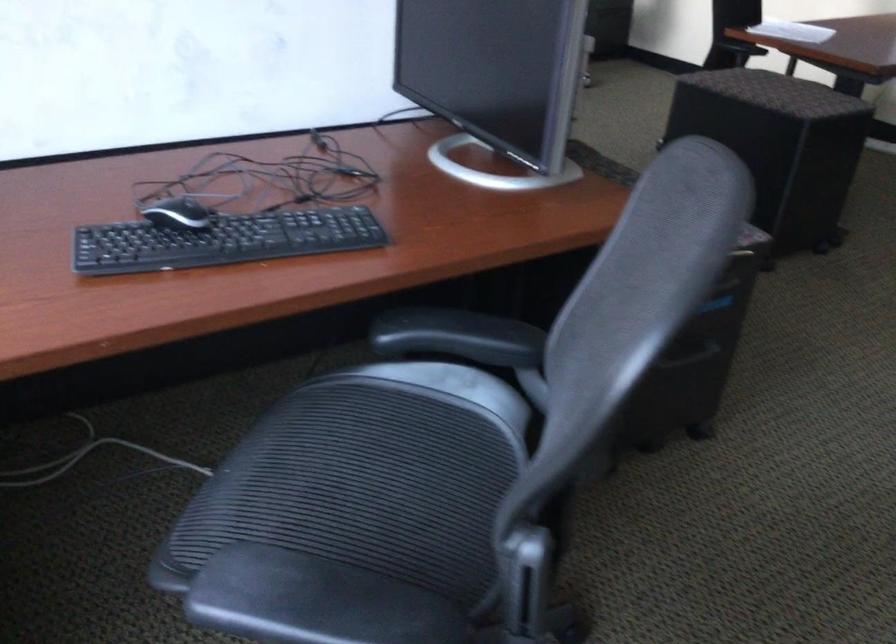
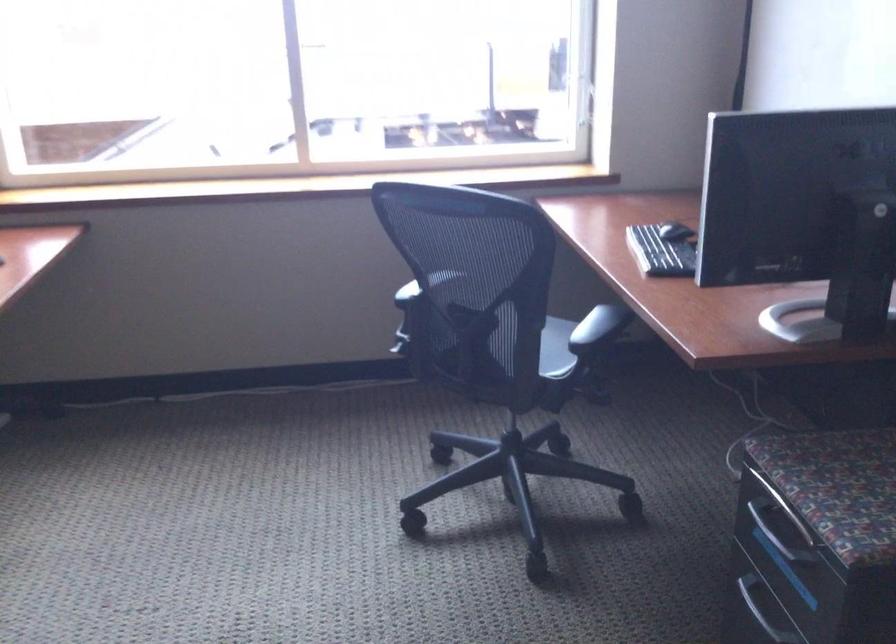
Question: I am providing you with two images of the same scene from different viewpoints. After the viewpoint changes to image2, which objects are now occluded?

Choices:
 (A) glass ball ornament
 (B) silver drawer handle
 (C) chair sitting surface
 (D) black computer mouse

Answer: (C)